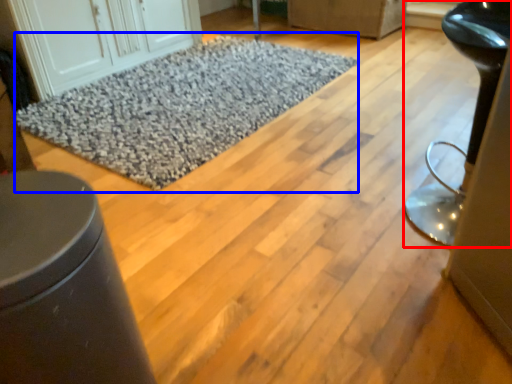
Question: Which object appears closest to the camera in this image, furniture (highlighted by a red box) or mat (highlighted by a blue box)?

Choices:
 (A) furniture
 (B) mat

Answer: (A)